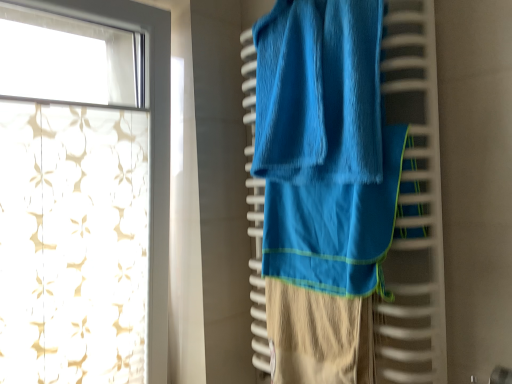
Find the location of a particular element. Image resolution: width=512 pixels, height=384 pixels. blue soft towel at center is located at coordinates (325, 146).

Describe the element at coordinates (325, 146) in the screenshot. Image resolution: width=512 pixels, height=384 pixels. I see `blue soft towel at center` at that location.

Measure the distance between blue soft towel at center and camera.

blue soft towel at center is 36.31 inches away from camera.

The width and height of the screenshot is (512, 384). What do you see at coordinates (150, 145) in the screenshot? I see `white sheer curtain at upper left` at bounding box center [150, 145].

In order to face white sheer curtain at upper left, should I rotate leftwards or rightwards?

You should rotate left by 21.343 degrees.

Locate an element on the screen. This screenshot has height=384, width=512. white sheer curtain at upper left is located at coordinates (150, 145).

Locate an element on the screen. blue soft towel at center is located at coordinates (325, 146).

Is blue soft towel at center to the right of white sheer curtain at upper left from the viewer's perspective?

Yes, blue soft towel at center is to the right of white sheer curtain at upper left.

Based on the photo, between blue soft towel at center and white sheer curtain at upper left, which one is positioned behind?

white sheer curtain at upper left is further from the camera.

Which is closer, [339,202] or [89,20]?

Point [339,202] is positioned closer to the camera compared to point [89,20].

From the image's perspective, would you say blue soft towel at center is shown under white sheer curtain at upper left?

No, from the image's perspective, blue soft towel at center is not beneath white sheer curtain at upper left.

From a real-world perspective, between blue soft towel at center and white sheer curtain at upper left, who is vertically higher?

white sheer curtain at upper left, from a real-world perspective.

Is blue soft towel at center wider or thinner than white sheer curtain at upper left?

Considering their sizes, blue soft towel at center looks slimmer than white sheer curtain at upper left.

Which of these two, blue soft towel at center or white sheer curtain at upper left, stands shorter?

With less height is blue soft towel at center.

Based on their sizes in the image, would you say blue soft towel at center is bigger or smaller than white sheer curtain at upper left?

Clearly, blue soft towel at center is smaller in size than white sheer curtain at upper left.

Is white sheer curtain at upper left located within blue soft towel at center?

No, white sheer curtain at upper left is located outside of blue soft towel at center.

Is the surface of blue soft towel at center in direct contact with white sheer curtain at upper left?

Answer: blue soft towel at center and white sheer curtain at upper left are clearly separated.

Is blue soft towel at center facing towards white sheer curtain at upper left?

No, blue soft towel at center is not turned towards white sheer curtain at upper left.

What's the angular difference between blue soft towel at center and white sheer curtain at upper left's facing directions?

The angle between the facing direction of blue soft towel at center and the facing direction of white sheer curtain at upper left is 94.4 degrees.

How distant is blue soft towel at center from white sheer curtain at upper left?

A distance of 20.86 inches exists between blue soft towel at center and white sheer curtain at upper left.

Find the location of a particular element. Image resolution: width=512 pixels, height=384 pixels. towel that appears above the white sheer curtain at upper left (from the image's perspective) is located at coordinates (325, 146).

Is white sheer curtain at upper left to the right of blue soft towel at center from the viewer's perspective?

No, white sheer curtain at upper left is not to the right of blue soft towel at center.

Which is behind, white sheer curtain at upper left or blue soft towel at center?

white sheer curtain at upper left is further away from the camera.

From the picture: Which is more distant, (152, 34) or (314, 121)?

Point (152, 34)

From the image's perspective, is white sheer curtain at upper left located above or below blue soft towel at center?

Clearly, from the image's perspective, white sheer curtain at upper left is below blue soft towel at center.

From a real-world perspective, does white sheer curtain at upper left sit lower than blue soft towel at center?

Actually, white sheer curtain at upper left is physically above blue soft towel at center in the real world.

Looking at their sizes, would you say white sheer curtain at upper left is wider or thinner than blue soft towel at center?

Clearly, white sheer curtain at upper left has more width compared to blue soft towel at center.

Is white sheer curtain at upper left taller than blue soft towel at center?

Correct, white sheer curtain at upper left is much taller as blue soft towel at center.

Consider the image. Between white sheer curtain at upper left and blue soft towel at center, which one has smaller size?

blue soft towel at center.

Is white sheer curtain at upper left not inside blue soft towel at center?

Indeed, white sheer curtain at upper left is completely outside blue soft towel at center.

Is white sheer curtain at upper left not near blue soft towel at center?

white sheer curtain at upper left is near blue soft towel at center, not far away.

Is white sheer curtain at upper left looking in the opposite direction of blue soft towel at center?

No, blue soft towel at center is not at the back of white sheer curtain at upper left.

How far apart are white sheer curtain at upper left and blue soft towel at center?

white sheer curtain at upper left and blue soft towel at center are 52.98 centimeters apart from each other.

Where is `curtain below the blue soft towel at center (from the image's perspective)`? This screenshot has height=384, width=512. curtain below the blue soft towel at center (from the image's perspective) is located at coordinates (150, 145).

Image resolution: width=512 pixels, height=384 pixels. I want to click on curtain behind the blue soft towel at center, so click(x=150, y=145).

Find the location of a particular element. This screenshot has width=512, height=384. towel on the right of white sheer curtain at upper left is located at coordinates (325, 146).